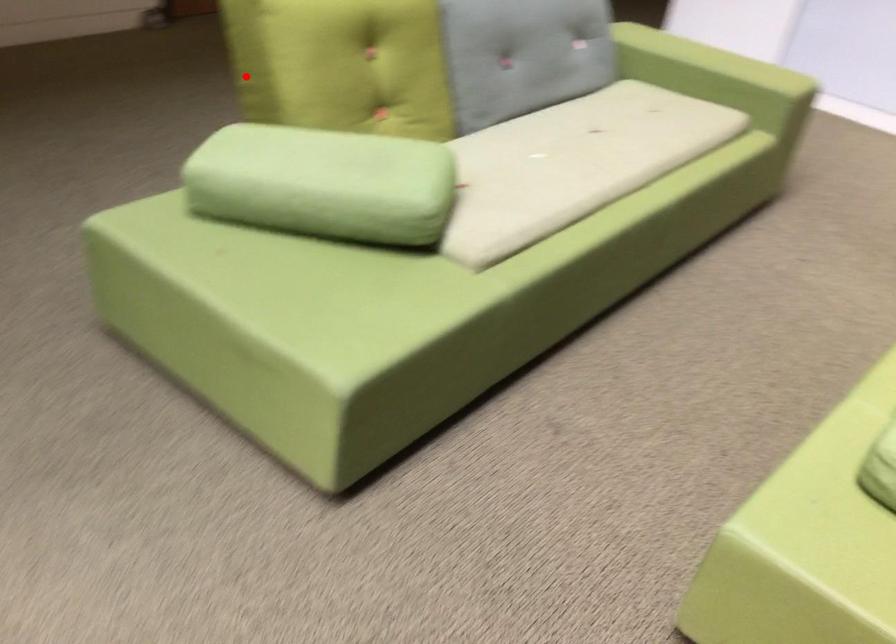
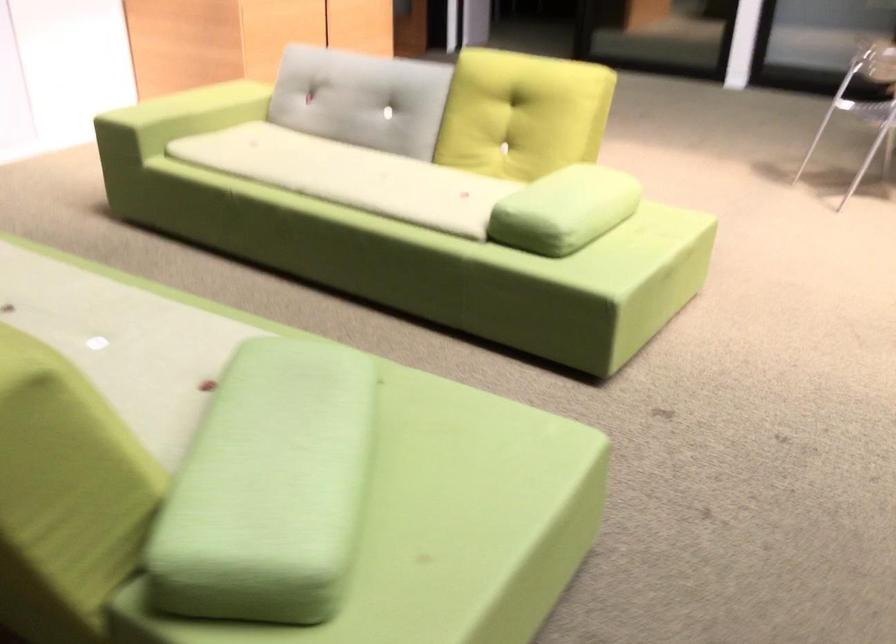
Question: I am providing you with two images of the same scene from different viewpoints. Image1 has a red point marked. In image2, the corresponding 3D location appears at what relative position? Reply with the corresponding letter.

Choices:
 (A) Closer
 (B) Farther

Answer: (A)